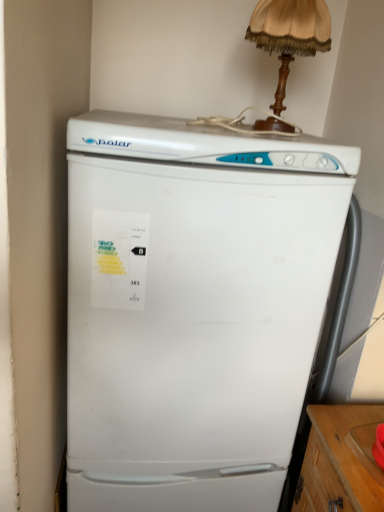
Question: Should I look upward or downward to see white matte refrigerator at center?

Choices:
 (A) down
 (B) up

Answer: (A)

Question: Can you confirm if white matte refrigerator at center is wider than wooden table lamp at upper center?

Choices:
 (A) yes
 (B) no

Answer: (A)

Question: From the image's perspective, is white matte refrigerator at center below wooden table lamp at upper center?

Choices:
 (A) no
 (B) yes

Answer: (B)

Question: Is white matte refrigerator at center shorter than wooden table lamp at upper center?

Choices:
 (A) yes
 (B) no

Answer: (B)

Question: Is white matte refrigerator at center with wooden table lamp at upper center?

Choices:
 (A) yes
 (B) no

Answer: (B)

Question: Is wooden table lamp at upper center at the back of white matte refrigerator at center?

Choices:
 (A) yes
 (B) no

Answer: (B)

Question: Is white matte refrigerator at center far from wooden table lamp at upper center?

Choices:
 (A) yes
 (B) no

Answer: (B)

Question: Does wooden table lamp at upper center appear on the left side of white matte refrigerator at center?

Choices:
 (A) no
 (B) yes

Answer: (A)

Question: Is wooden table lamp at upper center located outside white matte refrigerator at center?

Choices:
 (A) no
 (B) yes

Answer: (B)

Question: Does wooden table lamp at upper center have a greater width compared to white matte refrigerator at center?

Choices:
 (A) yes
 (B) no

Answer: (B)

Question: Is wooden table lamp at upper center bigger than white matte refrigerator at center?

Choices:
 (A) no
 (B) yes

Answer: (A)

Question: Is wooden table lamp at upper center smaller than white matte refrigerator at center?

Choices:
 (A) no
 (B) yes

Answer: (B)

Question: Is wooden table lamp at upper center further to camera compared to white matte refrigerator at center?

Choices:
 (A) yes
 (B) no

Answer: (A)

Question: From a real-world perspective, is wooden table lamp at upper center positioned above or below white matte refrigerator at center?

Choices:
 (A) below
 (B) above

Answer: (B)